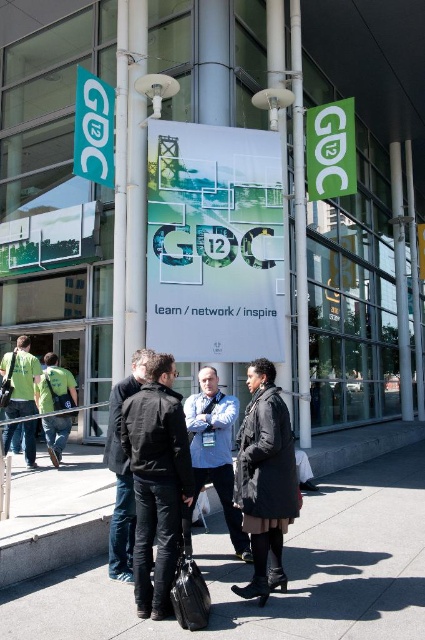
Question: In this image, where is green plastic sign at upper left located relative to green fabric jacket at left?

Choices:
 (A) above
 (B) below

Answer: (A)

Question: Which of the following is the farthest from the observer?

Choices:
 (A) (28, 403)
 (B) (119, 412)

Answer: (A)

Question: Is green fabric shirt at left bigger than green fabric jacket at left?

Choices:
 (A) no
 (B) yes

Answer: (B)

Question: Which of the following is the closest to the observer?

Choices:
 (A) [30, 438]
 (B) [198, 454]

Answer: (B)

Question: Can you confirm if black matte coat at center is positioned to the left of dark gray jacket at center?

Choices:
 (A) yes
 (B) no

Answer: (B)

Question: Which point is farther to the camera?

Choices:
 (A) (34, 429)
 (B) (107, 140)

Answer: (A)